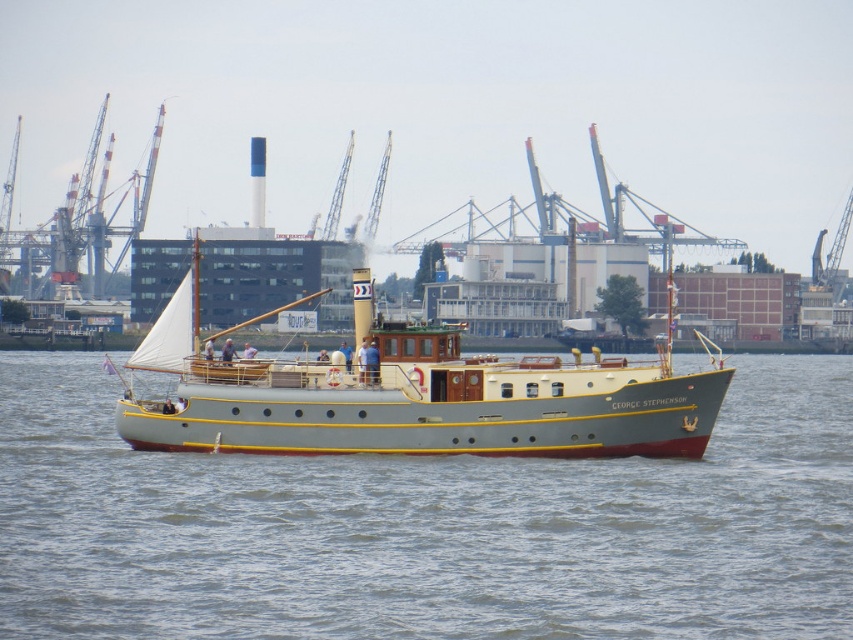
Does smooth gray water at center appear on the right side of light gray polished wood boat at center?

Yes, smooth gray water at center is to the right of light gray polished wood boat at center.

Which is more to the right, smooth gray water at center or light gray polished wood boat at center?

From the viewer's perspective, smooth gray water at center appears more on the right side.

Where is `smooth gray water at center`? smooth gray water at center is located at coordinates (426, 525).